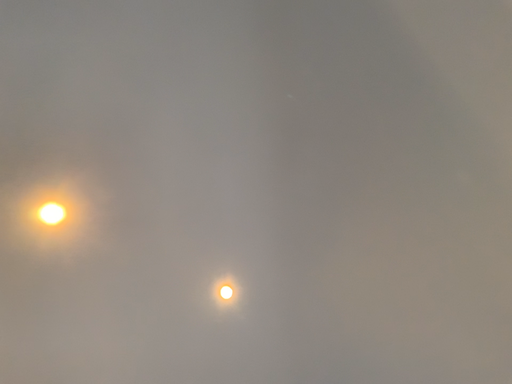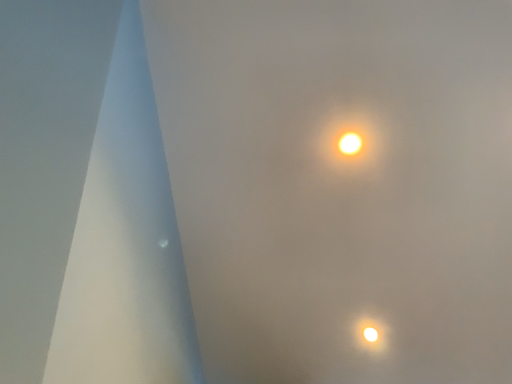
Question: Which way did the camera rotate in the video?

Choices:
 (A) rotated upward
 (B) rotated downward

Answer: (B)